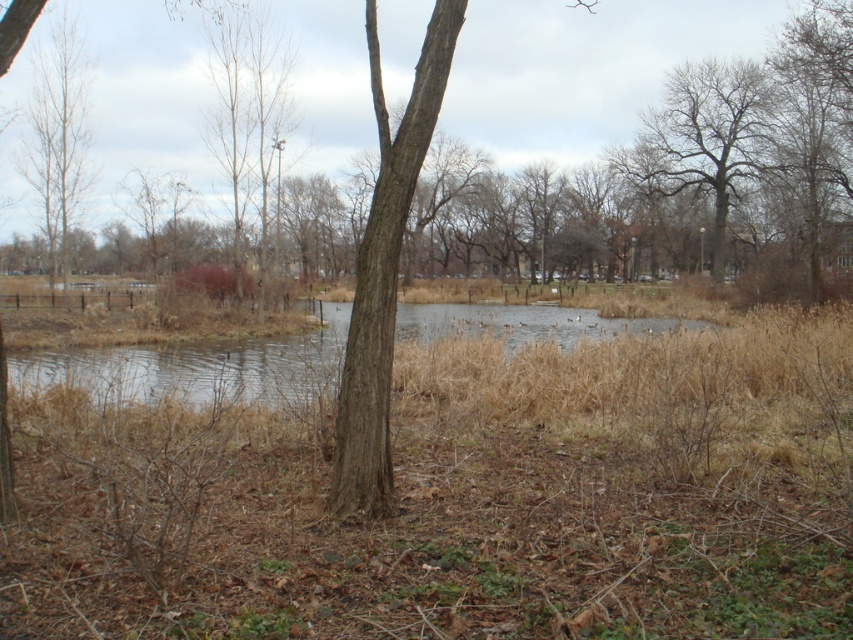
Is bare branches tree at upper right smaller than bare wood tree at left?

Yes.

Is point (688, 160) positioned after point (62, 20)?

Yes, it is.

The height and width of the screenshot is (640, 853). What are the coordinates of `bare branches tree at upper right` in the screenshot? It's located at (705, 138).